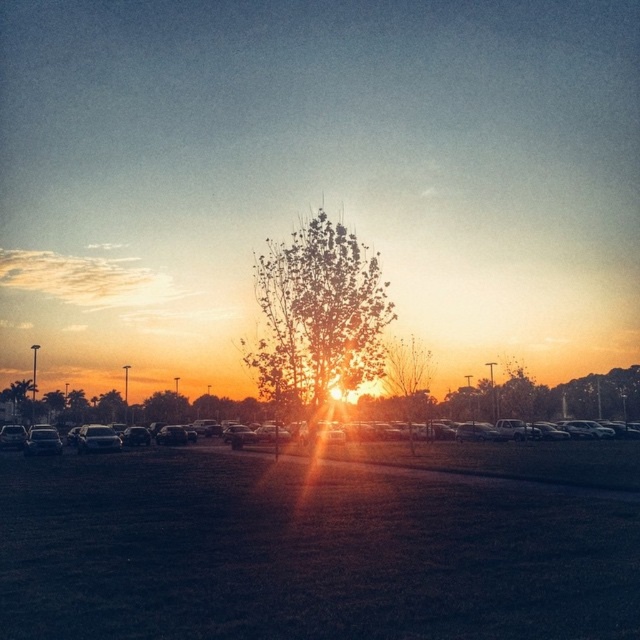
Can you confirm if green leafy tree at center is smaller than metallic cars at center?

Yes, green leafy tree at center is smaller than metallic cars at center.

Between point (266, 337) and point (548, 436), which one is positioned in front?

Point (266, 337)

Does point (268, 394) come behind point (461, 436)?

No, (268, 394) is closer to viewer.

Where is `green leafy tree at center`? The width and height of the screenshot is (640, 640). green leafy tree at center is located at coordinates (317, 316).